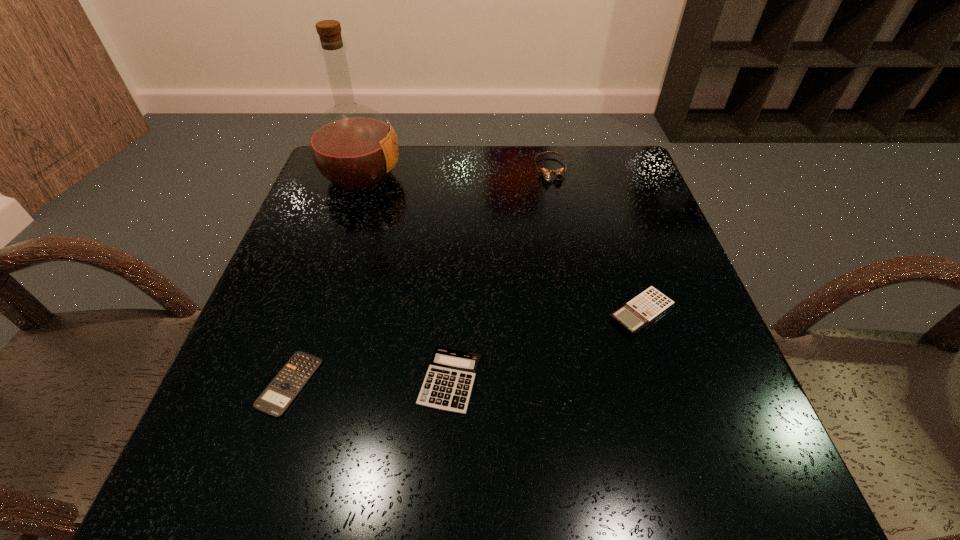
The width and height of the screenshot is (960, 540). In the image, there is a desktop. Find the location of `vacant space at the near edge`. vacant space at the near edge is located at coordinates (519, 507).

I want to click on blank space at the left edge of the desktop, so tap(214, 405).

Find the location of `free space at the right edge of the desktop`. free space at the right edge of the desktop is located at coordinates (686, 346).

I want to click on vacant space at the far left corner of the desktop, so click(361, 195).

Find the location of a particular element. The height and width of the screenshot is (540, 960). free region at the near left corner of the desktop is located at coordinates (270, 483).

In the image, there is a desktop. Where is `vacant space at the far right corner`? vacant space at the far right corner is located at coordinates (616, 186).

Find the location of a particular element. This screenshot has height=540, width=960. free space between the tallest object and the farthest calculator is located at coordinates (501, 244).

What are the coordinates of `vacant area that lies between the third nearest object and the fourth object from left to right` in the screenshot? It's located at (596, 241).

The height and width of the screenshot is (540, 960). I want to click on vacant area that lies between the fourth shortest object and the third object from left to right, so click(x=500, y=275).

Identify the location of vacant space that's between the tallest object and the second calculator from left to right. The height and width of the screenshot is (540, 960). [405, 278].